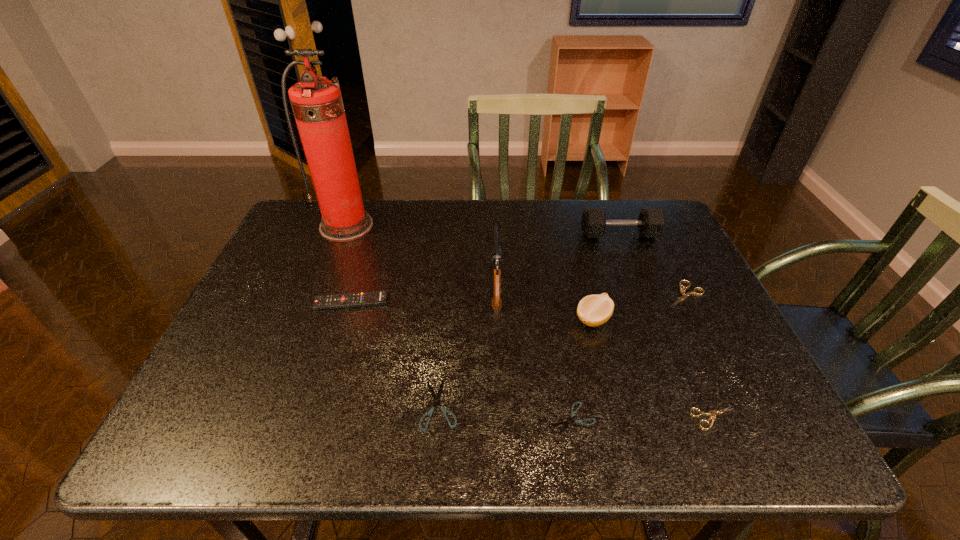
What are the coordinates of `object located at the far right corner` in the screenshot? It's located at (651, 222).

Where is `object situated at the near right corner`? The height and width of the screenshot is (540, 960). object situated at the near right corner is located at coordinates (713, 412).

Where is `free spot at the far edge of the desktop`? Image resolution: width=960 pixels, height=540 pixels. free spot at the far edge of the desktop is located at coordinates (533, 221).

Image resolution: width=960 pixels, height=540 pixels. I want to click on vacant space at the near edge of the desktop, so click(321, 422).

In order to click on free space at the left edge of the desktop in this screenshot , I will do `click(291, 315)`.

What are the coordinates of `vacant region at the right edge` in the screenshot? It's located at (637, 255).

In the image, there is a desktop. At what (x,y) coordinates should I click in order to perform the action: click on free region at the near left corner. Please return your answer as a coordinate pair (x, y). This screenshot has height=540, width=960. Looking at the image, I should click on (166, 452).

Where is `vacant space at the far right corner`? Image resolution: width=960 pixels, height=540 pixels. vacant space at the far right corner is located at coordinates [653, 199].

Identify the location of free spot at the near right corner of the desktop. (725, 444).

Find the location of a particular element. vacant space that's between the remote control and the third shears from right to left is located at coordinates (462, 360).